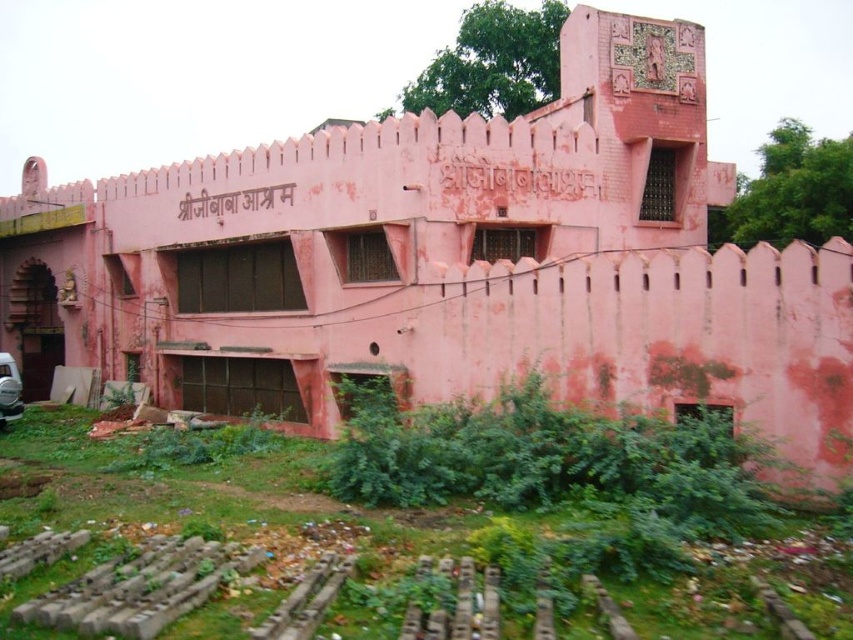
You are standing in front of the pink building and want to take a photo of the metallic silver car at lower left. Where should you position yourself to ensure the green grass at lower left is visible in the background?

To capture the green grass at lower left in the background while photographing the metallic silver car at lower left, position yourself so that the car is centered in your viewfinder and slightly lower, allowing the grass behind it to appear in the upper part of the frame. Since the green grass at lower left is below the metallic silver car at lower left, adjusting your angle downward will frame both elements effectively.

You are standing at the front entrance of the pink building and want to walk to the metallic silver car at lower left. There is green grass at lower left between you and the car. Can you reach the car without stepping on the grass?

The distance between the green grass at lower left and the metallic silver car at lower left is 10.40 meters. Since the grass is between you and the car, you would have to step on the grass to reach the car unless there is a path around it. The question does not mention any alternative path, so you would need to step on the grass to reach the car.